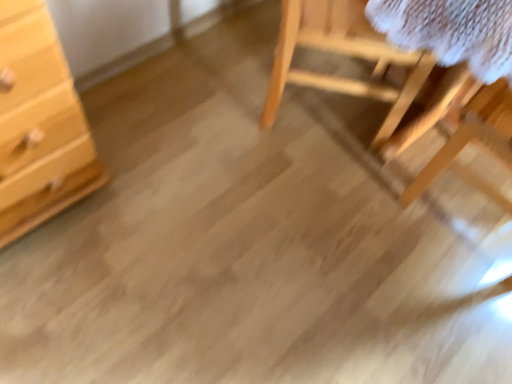
Question: Considering the positions of light wood chest of drawers at left and natural wood chair at upper right in the image, is light wood chest of drawers at left bigger or smaller than natural wood chair at upper right?

Choices:
 (A) big
 (B) small

Answer: (B)

Question: From the image's perspective, is light wood chest of drawers at left positioned above or below natural wood chair at upper right?

Choices:
 (A) above
 (B) below

Answer: (B)

Question: Which object is the farthest from the light wood chest of drawers at left?

Choices:
 (A) natural wood chair at upper right
 (B) wooden table at right

Answer: (B)

Question: Which object is the closest to the natural wood chair at upper right?

Choices:
 (A) light wood chest of drawers at left
 (B) wooden table at right

Answer: (B)